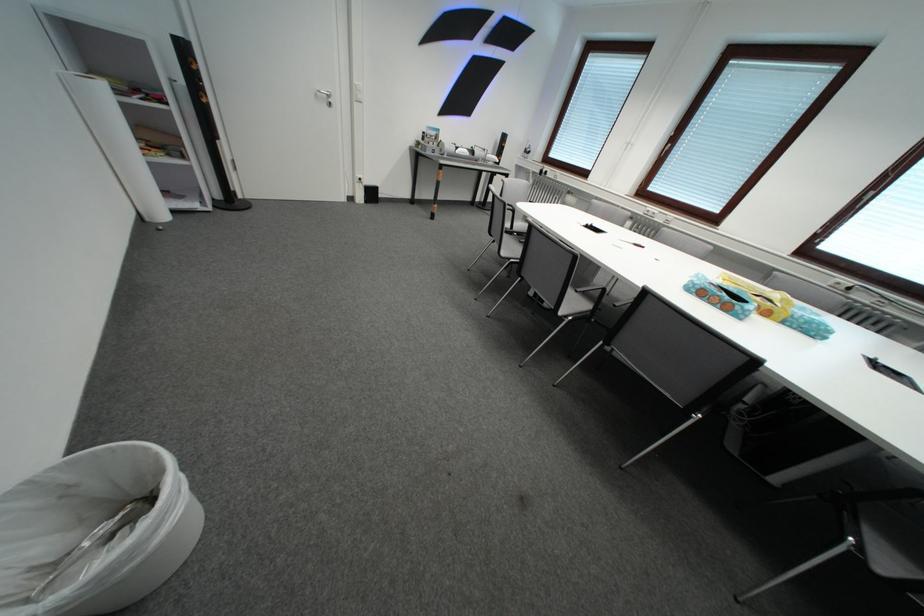
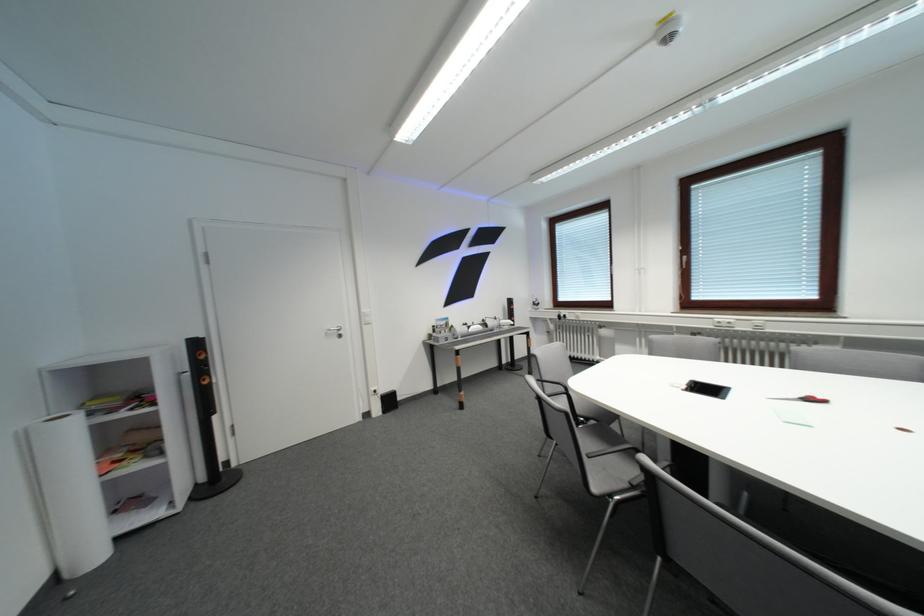
In the second image, find the point that corresponds to (x=467, y=151) in the first image.

(479, 330)